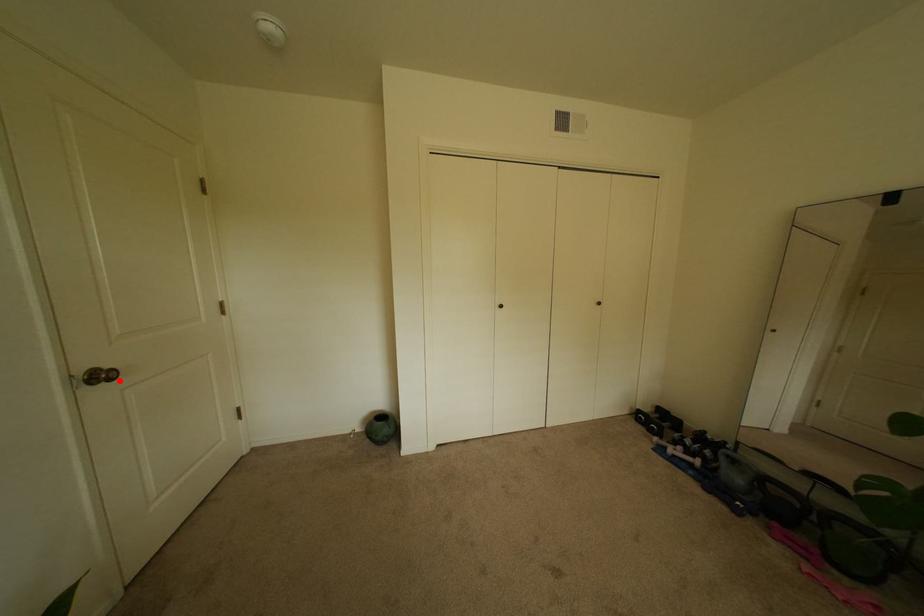
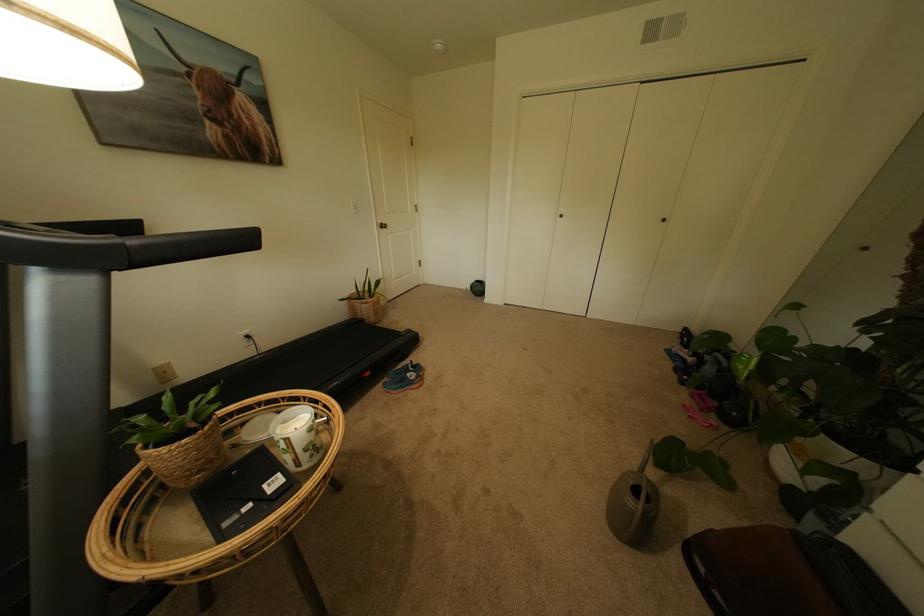
Question: I am providing you with two images of the same scene from different viewpoints. In image1, a red point is highlighted. Considering the same 3D point in image2, which of the following is correct?

Choices:
 (A) It is closer
 (B) It is farther

Answer: (A)